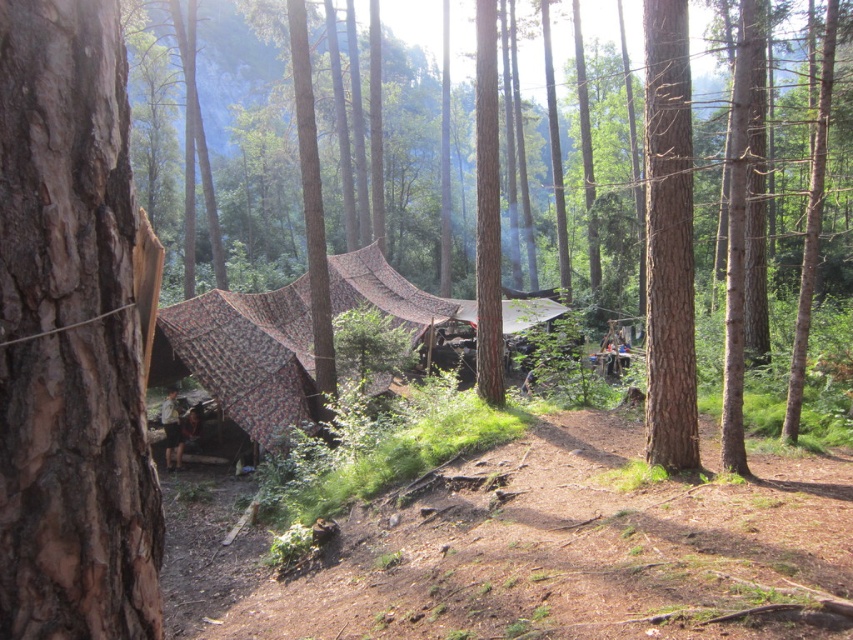
Is brown dirt track at center bigger than smooth brown tree trunk at right?

Incorrect, brown dirt track at center is not larger than smooth brown tree trunk at right.

Is brown dirt track at center wider than smooth brown tree trunk at right?

Yes.

Between point (607, 612) and point (664, 20), which one is positioned in front?

Point (607, 612) is in front.

Image resolution: width=853 pixels, height=640 pixels. I want to click on brown dirt track at center, so click(x=576, y=550).

Does brown dirt track at center appear on the right side of brown rough bark tree at left?

No, brown dirt track at center is not to the right of brown rough bark tree at left.

In the scene shown: Is brown dirt track at center behind brown rough bark tree at left?

No, it is not.

Between point (741, 541) and point (175, 356), which one is positioned behind?

The point (175, 356) is more distant.

The height and width of the screenshot is (640, 853). I want to click on brown dirt track at center, so click(x=576, y=550).

Which is more to the left, brown dirt track at center or brown rough bark at left?

Positioned to the left is brown rough bark at left.

Which of these two, brown dirt track at center or brown rough bark at left, stands shorter?

With less height is brown dirt track at center.

I want to click on brown dirt track at center, so click(576, 550).

Identify the location of brown dirt track at center. (576, 550).